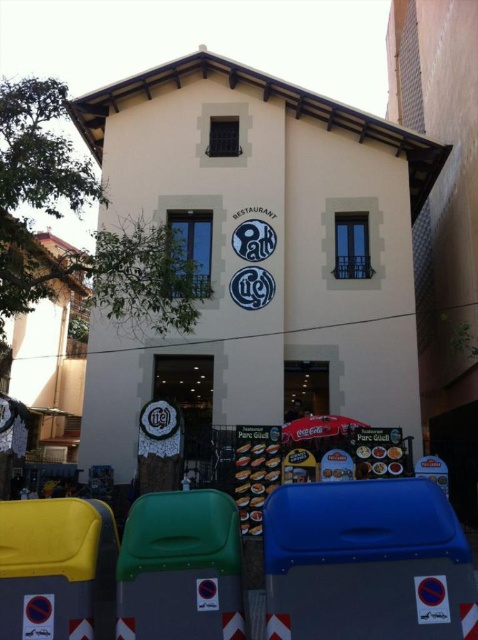
Is blue plastic bin at lower right shorter than green plastic bin at lower left?

Yes, blue plastic bin at lower right is shorter than green plastic bin at lower left.

Where is `blue plastic bin at lower right`? blue plastic bin at lower right is located at coordinates (367, 563).

Locate an element on the screen. Image resolution: width=478 pixels, height=640 pixels. blue plastic bin at lower right is located at coordinates (367, 563).

Which is below, blue plastic bin at lower right or yellow plastic bin at lower left?

yellow plastic bin at lower left is below.

Which is in front, point (432, 572) or point (104, 513)?

Point (432, 572) is more forward.

Where is `blue plastic bin at lower right`? blue plastic bin at lower right is located at coordinates (367, 563).

Looking at this image, is green plastic bin at lower left thinner than yellow plastic bin at lower left?

No.

Is green plastic bin at lower left above yellow plastic bin at lower left?

Indeed, green plastic bin at lower left is positioned over yellow plastic bin at lower left.

Is point (235, 596) behind point (23, 552)?

No.

Find the location of a particular element. This screenshot has width=478, height=640. green plastic bin at lower left is located at coordinates (x=181, y=568).